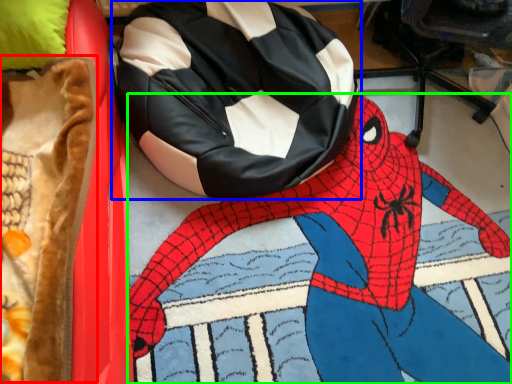
Question: Which is farther away from blanket (highlighted by a red box)? bean bag chair (highlighted by a blue box) or person (highlighted by a green box)?

Choices:
 (A) bean bag chair
 (B) person

Answer: (B)